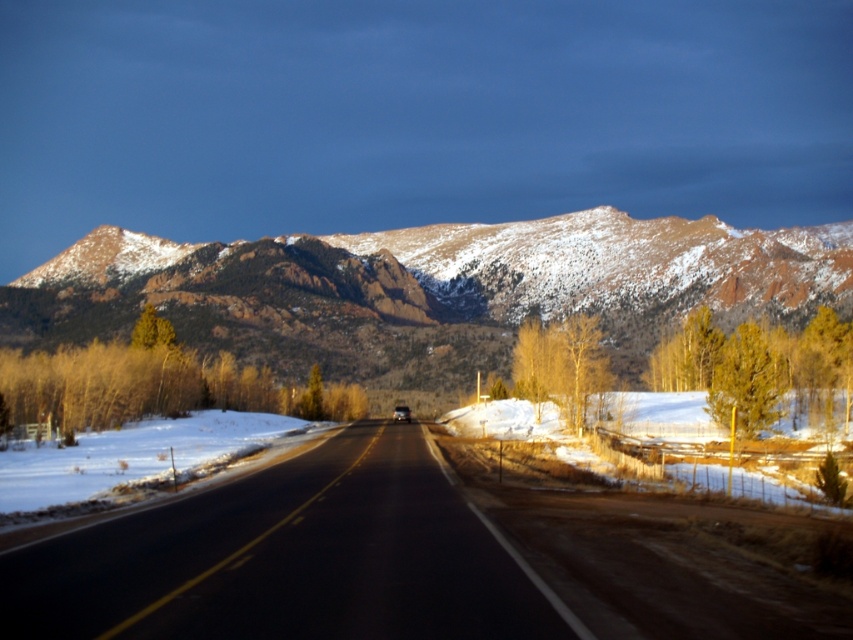
You are a pedestrian standing at the side of the road. You see the black asphalt road at center and the metallic silver car at center. Which object is closer to your right side?

The black asphalt road at center is to the right of the metallic silver car at center, so the black asphalt road at center is closer to your right side.

You are a drone operator planning to fly a drone from your current position to the point marked at coordinates point [436,256]. The drone has a maximum range of 900 feet. Based on the scene, will the drone reach the point before running out of battery?

The point [436,256] is 893.13 feet away from the camera, so yes, the drone can reach it since it is within the 900 feet range.